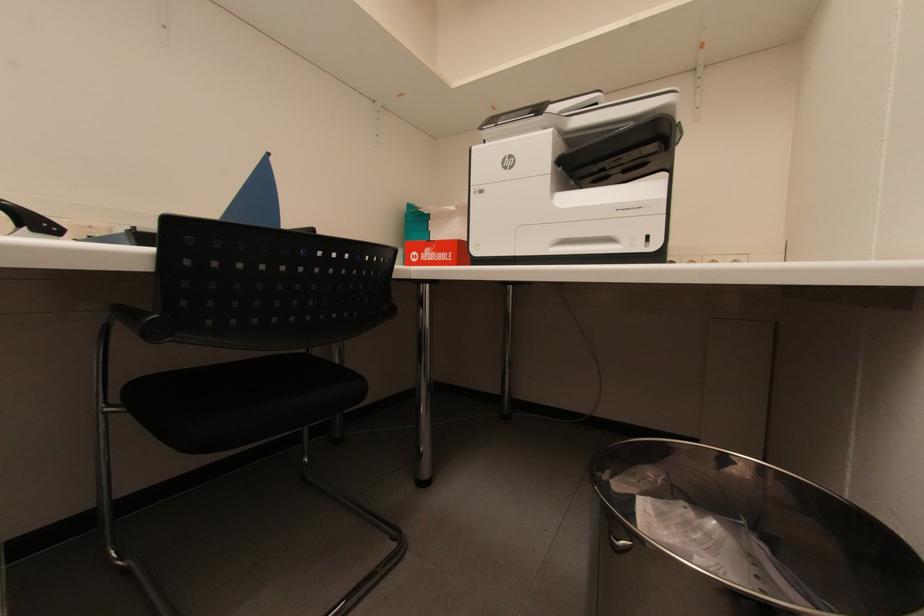
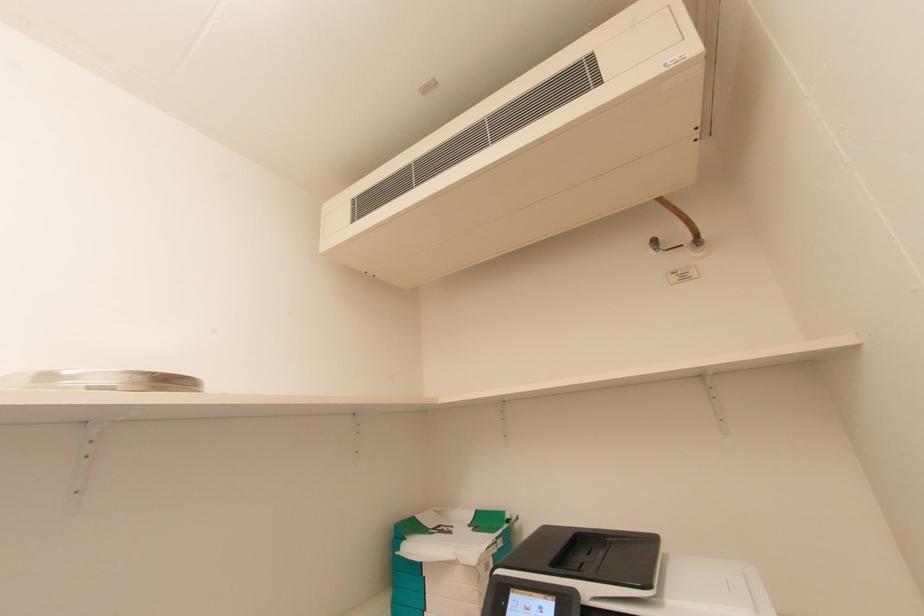
Question: Based on the continuous images, in which direction is the camera rotating? Reply with the corresponding letter.

Choices:
 (A) Left
 (B) Right
 (C) Up
 (D) Down

Answer: (C)